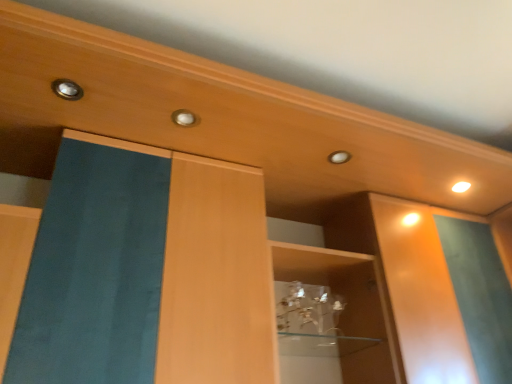
Question: From the image's perspective, does white glossy light at upper right appear higher than matte metallic knob at upper left, the 1th knob positioned from the top?

Choices:
 (A) yes
 (B) no

Answer: (B)

Question: Is white glossy light at upper right in front of matte metallic knob at upper left, marked as the 2th knob in a bottom-to-top arrangement?

Choices:
 (A) no
 (B) yes

Answer: (A)

Question: Considering the relative sizes of white glossy light at upper right and matte metallic knob at upper left, marked as the 2th knob in a bottom-to-top arrangement, in the image provided, is white glossy light at upper right smaller than matte metallic knob at upper left, marked as the 2th knob in a bottom-to-top arrangement,?

Choices:
 (A) no
 (B) yes

Answer: (B)

Question: Considering the relative sizes of white glossy light at upper right and matte metallic knob at upper left, the second knob when ordered from right to left, in the image provided, is white glossy light at upper right bigger than matte metallic knob at upper left, the second knob when ordered from right to left,?

Choices:
 (A) yes
 (B) no

Answer: (B)

Question: Is white glossy light at upper right far from matte metallic knob at upper left, which is the first knob in front-to-back order?

Choices:
 (A) yes
 (B) no

Answer: (A)

Question: From the image's perspective, relative to matte gold knob at center, which is the first knob in right-to-left order, is matte metallic knob at upper left, which ranks as the first knob in left-to-right order, above or below?

Choices:
 (A) above
 (B) below

Answer: (A)

Question: Considering their positions, is matte metallic knob at upper left, which is the first knob in front-to-back order, located in front of or behind matte gold knob at center, which is the second knob in top-to-bottom order?

Choices:
 (A) front
 (B) behind

Answer: (A)

Question: Is matte metallic knob at upper left, the 1th knob positioned from the top, inside the boundaries of matte gold knob at center, which appears as the 2th knob when viewed from the front, or outside?

Choices:
 (A) inside
 (B) outside

Answer: (B)

Question: Is matte metallic knob at upper left, positioned as the 2th knob in back-to-front order, wider or thinner than matte gold knob at center, which ranks as the first knob in bottom-to-top order?

Choices:
 (A) thin
 (B) wide

Answer: (A)

Question: Considering the positions of matte metallic knob at upper left, positioned as the 2th knob in back-to-front order, and white glossy light at upper right in the image, is matte metallic knob at upper left, positioned as the 2th knob in back-to-front order, taller or shorter than white glossy light at upper right?

Choices:
 (A) short
 (B) tall

Answer: (A)

Question: In the image, is matte metallic knob at upper left, which ranks as the first knob in left-to-right order, on the left side or the right side of white glossy light at upper right?

Choices:
 (A) right
 (B) left

Answer: (B)

Question: Would you say matte metallic knob at upper left, the 1th knob positioned from the top, is inside or outside white glossy light at upper right?

Choices:
 (A) inside
 (B) outside

Answer: (B)

Question: Is point (72, 87) positioned closer to the camera than point (463, 183)?

Choices:
 (A) farther
 (B) closer

Answer: (B)

Question: From the image's perspective, is matte gold knob at center, which is the first knob in back-to-front order, above or below matte metallic knob at upper left, marked as the 2th knob in a bottom-to-top arrangement?

Choices:
 (A) below
 (B) above

Answer: (A)

Question: Is matte gold knob at center, which is the first knob in back-to-front order, in front of or behind matte metallic knob at upper left, which ranks as the first knob in left-to-right order, in the image?

Choices:
 (A) behind
 (B) front

Answer: (A)